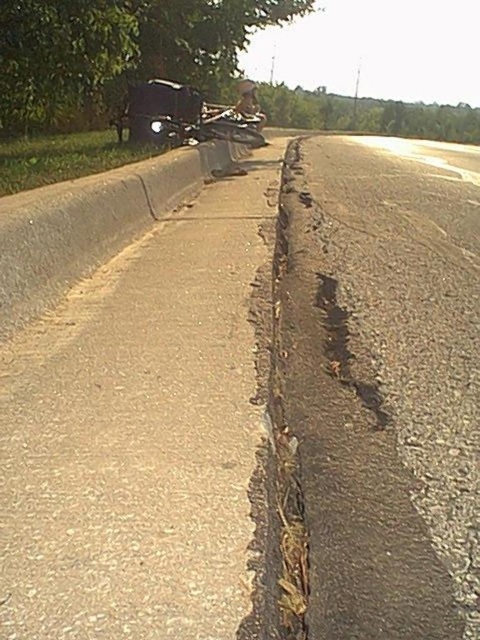
Is shiny chrome motorcycle at center closer to camera compared to metallic silver helmet at center?

Yes, it is.

Describe the element at coordinates (213, 125) in the screenshot. The image size is (480, 640). I see `shiny chrome motorcycle at center` at that location.

I want to click on shiny chrome motorcycle at center, so click(213, 125).

Is green leafy tree at upper center positioned in front of shiny chrome motorcycle at center?

That is True.

Is green leafy tree at upper center further to camera compared to shiny chrome motorcycle at center?

No, it is not.

The width and height of the screenshot is (480, 640). In order to click on green leafy tree at upper center in this screenshot , I will do `click(119, 51)`.

Find the location of `green leafy tree at upper center`. green leafy tree at upper center is located at coordinates click(x=119, y=51).

Can you confirm if green leafy tree at upper center is positioned to the right of metallic silver helmet at center?

Incorrect, green leafy tree at upper center is not on the right side of metallic silver helmet at center.

Does green leafy tree at upper center appear over metallic silver helmet at center?

Incorrect, green leafy tree at upper center is not positioned above metallic silver helmet at center.

Which is in front, point (113, 17) or point (264, 115)?

Point (113, 17) is in front.

Find the location of `green leafy tree at upper center`. green leafy tree at upper center is located at coordinates (119, 51).